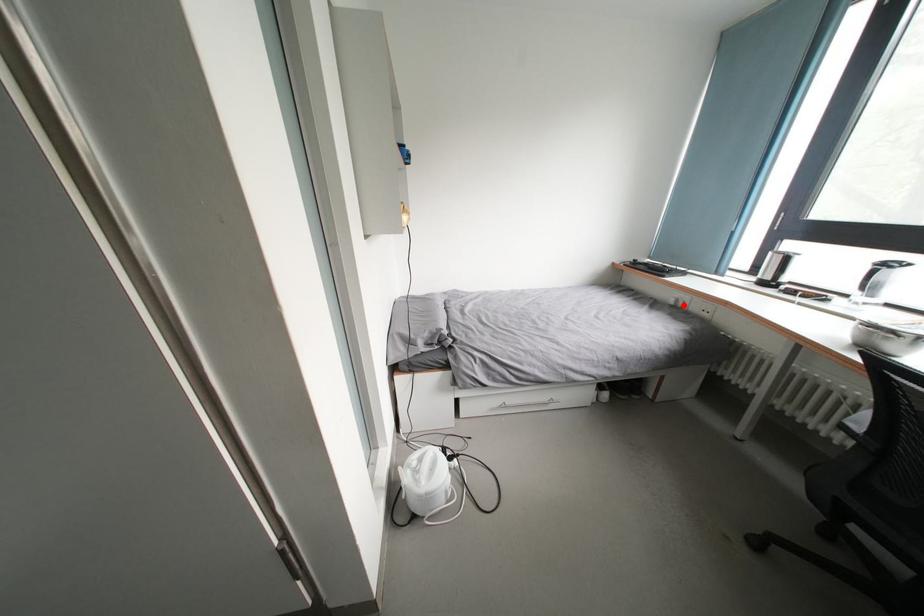
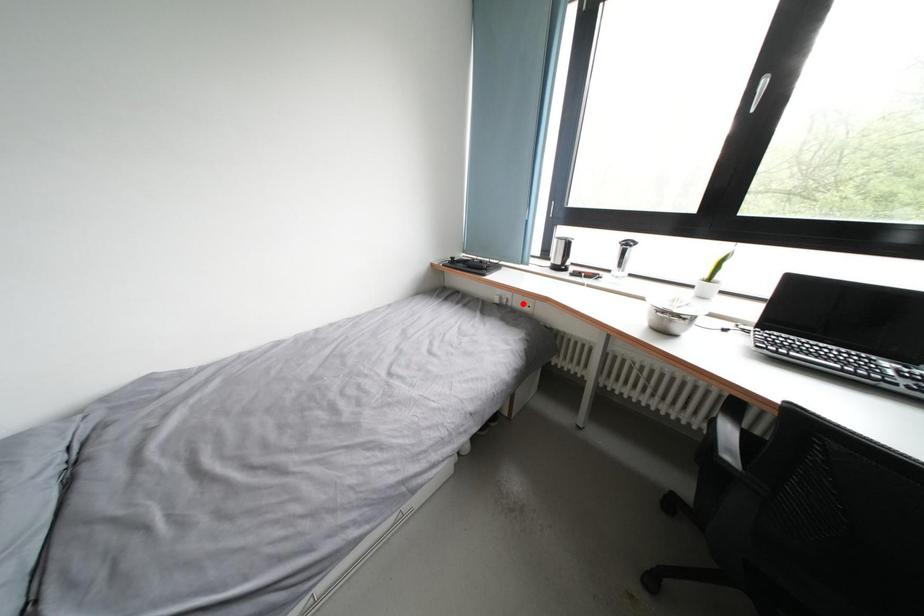
I am providing you with two images of the same scene from different viewpoints. A red point is marked on the first image and another point is marked on the second image. Do the highlighted points in image1 and image2 indicate the same real-world spot?

No